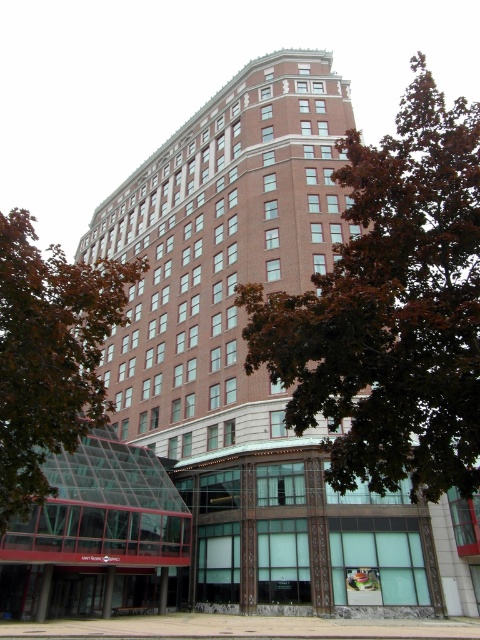
Can you confirm if brown leafy tree at upper center is bigger than green leafy tree at lower left?

Yes, brown leafy tree at upper center is bigger than green leafy tree at lower left.

Can you confirm if brown leafy tree at upper center is positioned below green leafy tree at lower left?

Actually, brown leafy tree at upper center is above green leafy tree at lower left.

Which is in front, point (442, 445) or point (22, 317)?

Positioned in front is point (22, 317).

At what (x,y) coordinates should I click in order to perform the action: click on brown leafy tree at upper center. Please return your answer as a coordinate pair (x, y). Looking at the image, I should click on (391, 308).